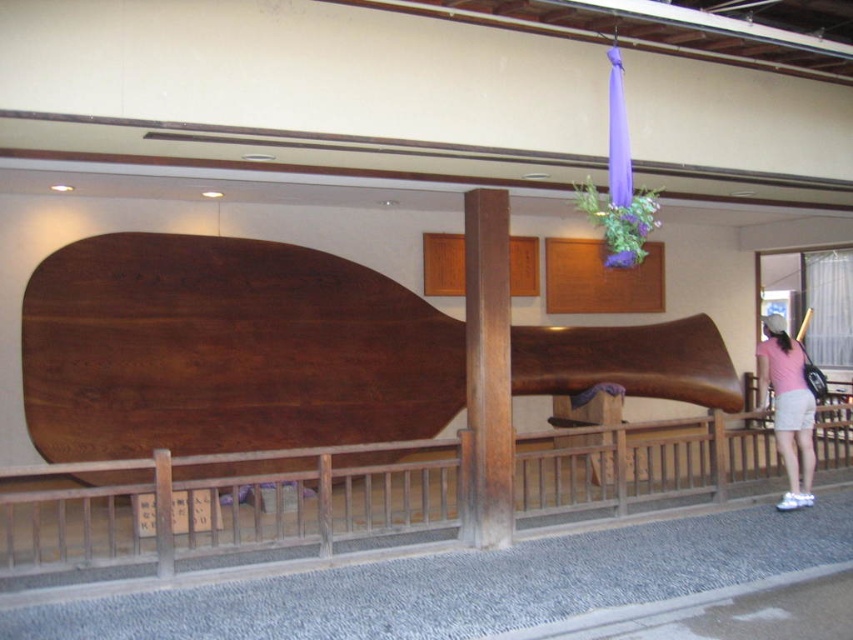
You are a visitor standing in front of the display case. You see the wooden at lower center and the brown polished wood at center. Which object is closer to you?

The wooden at lower center is closer to you because it is further to the viewer than the brown polished wood at center.